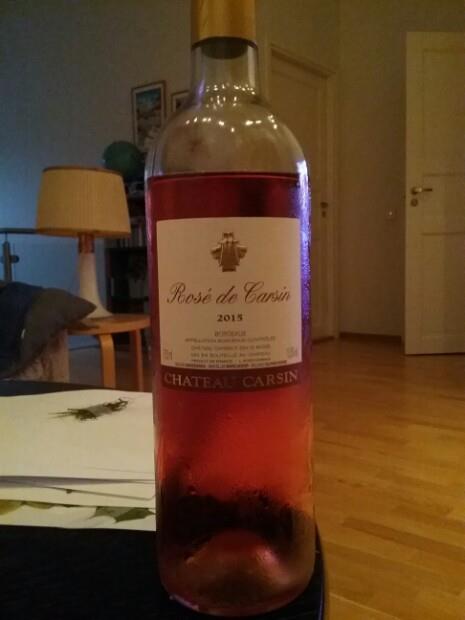
What are the coordinates of `bottle of pink champagne` in the screenshot? It's located at (173, 595), (313, 551), (236, 549), (154, 379), (238, 407), (245, 239), (216, 157), (194, 60), (248, 6).